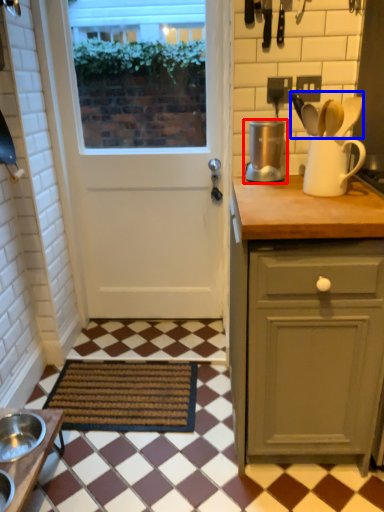
Question: Which object is closer to the camera taking this photo, kitchen appliance (highlighted by a red box) or silverware (highlighted by a blue box)?

Choices:
 (A) kitchen appliance
 (B) silverware

Answer: (B)